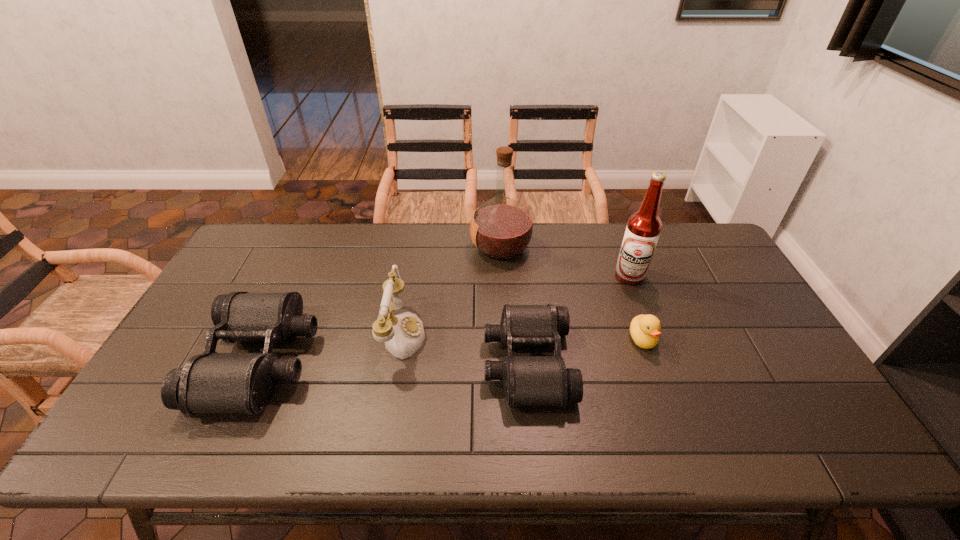
The width and height of the screenshot is (960, 540). I want to click on object that is at the near left corner, so click(211, 382).

The image size is (960, 540). What are the coordinates of `free space at the far edge of the desktop` in the screenshot? It's located at (612, 258).

I want to click on free space at the near edge, so click(302, 400).

You are a GUI agent. You are given a task and a screenshot of the screen. Output one action in this format:
    pyautogui.click(x=<x>, y=<y>)
    Task: Click on the vacant space at the left edge of the desktop
    
    Given the screenshot: What is the action you would take?
    pyautogui.click(x=228, y=286)

Where is `free space at the right edge of the desktop`? free space at the right edge of the desktop is located at coordinates (711, 266).

In the image, there is a desktop. Identify the location of vacant space at the far left corner. (250, 258).

In the image, there is a desktop. Identify the location of vacant space at the far right corner. (705, 224).

At what (x,y) coordinates should I click in order to perform the action: click on free space between the duckling and the taller binoculars. Please return your answer as a coordinate pair (x, y). This screenshot has height=540, width=960. Looking at the image, I should click on (451, 349).

Identify the location of empty space between the right binoculars and the taller binoculars. (394, 361).

Find the location of a particular element. The image size is (960, 540). free spot between the fourth tallest object and the duckling is located at coordinates (451, 349).